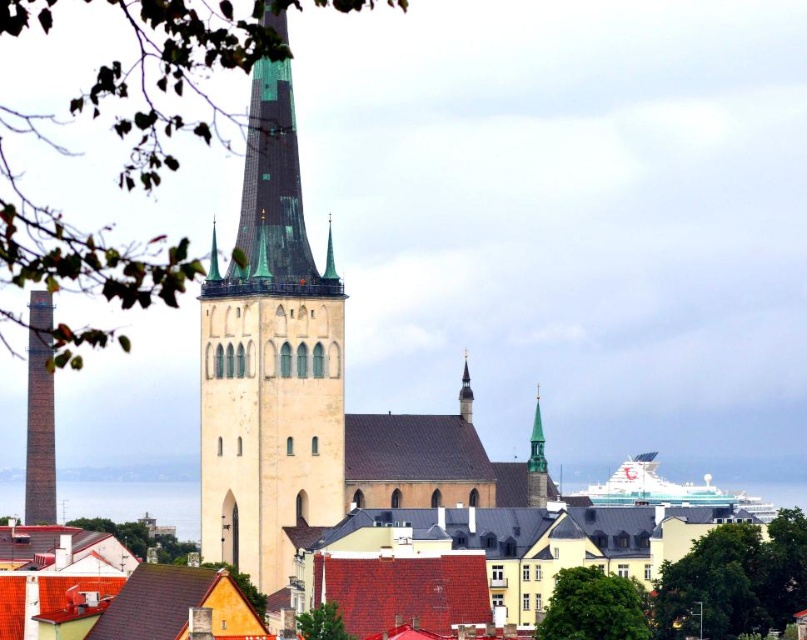
Question: In this image, where is transparent glass water at lower left located relative to brick chimney at left?

Choices:
 (A) right
 (B) left

Answer: (A)

Question: Observing the image, what is the correct spatial positioning of green stone spire at upper center in reference to green spire at center?

Choices:
 (A) right
 (B) left

Answer: (A)

Question: Which point is farther from the camera taking this photo?

Choices:
 (A) [529, 454]
 (B) [220, 472]
 (C) [190, 492]
 (D) [212, 243]

Answer: (C)

Question: Which point is farther from the camera taking this photo?

Choices:
 (A) (212, 269)
 (B) (527, 484)

Answer: (B)

Question: Observing the image, what is the correct spatial positioning of transparent glass water at lower left in reference to brick chimney at left?

Choices:
 (A) right
 (B) left

Answer: (A)

Question: Based on their relative distances, which object is nearer to the green stone spire at upper center?

Choices:
 (A) gold textured spire at center
 (B) green glazed tile spire at center
 (C) transparent glass water at lower left
 (D) green spire at center

Answer: (A)